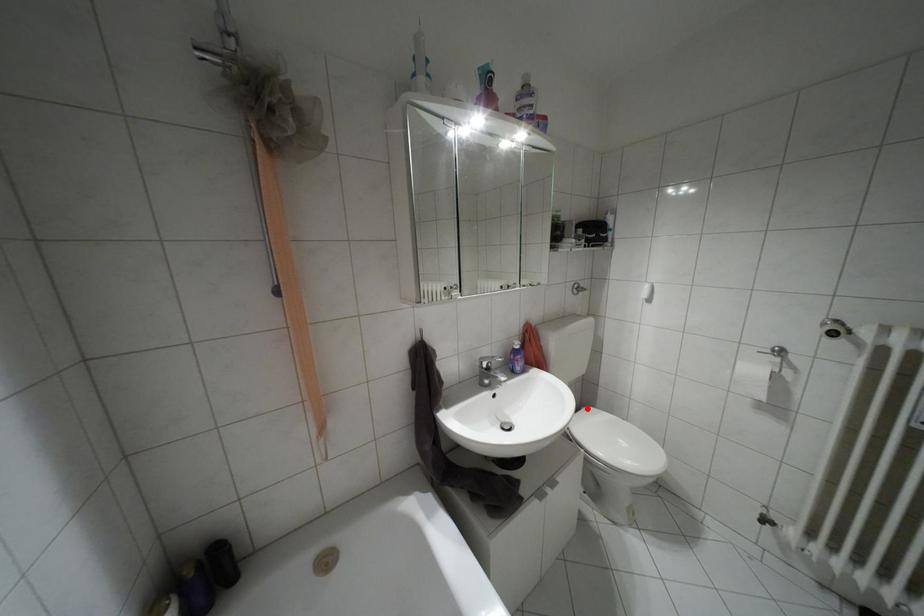
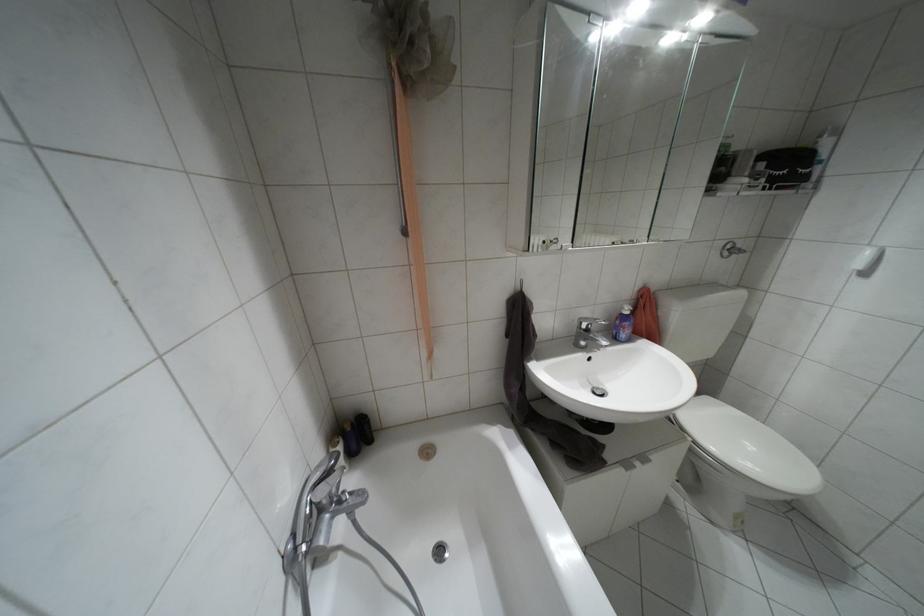
In the second image, find the point that corresponds to the highlighted location in the first image.

(706, 398)